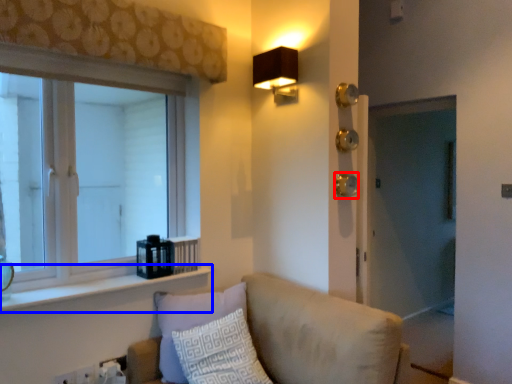
Question: Which object appears farthest to the camera in this image, door handle (highlighted by a red box) or window sill (highlighted by a blue box)?

Choices:
 (A) door handle
 (B) window sill

Answer: (A)